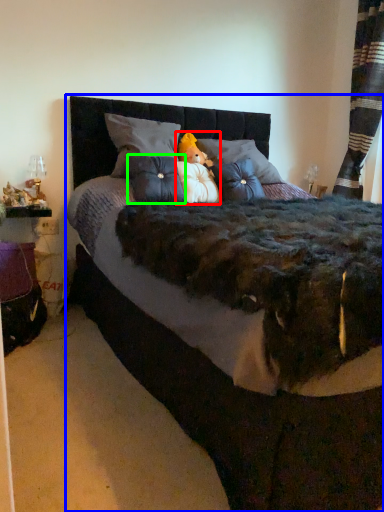
Question: Which object is positioned closest to toy (highlighted by a red box)? Select from bed (highlighted by a blue box) and throw pillow (highlighted by a green box).

Choices:
 (A) bed
 (B) throw pillow

Answer: (B)